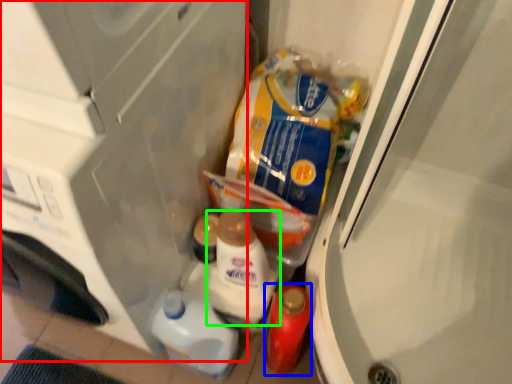
Question: Which is farther away from appliance (highlighted by a red box)? bottle (highlighted by a blue box) or snack (highlighted by a green box)?

Choices:
 (A) bottle
 (B) snack

Answer: (A)